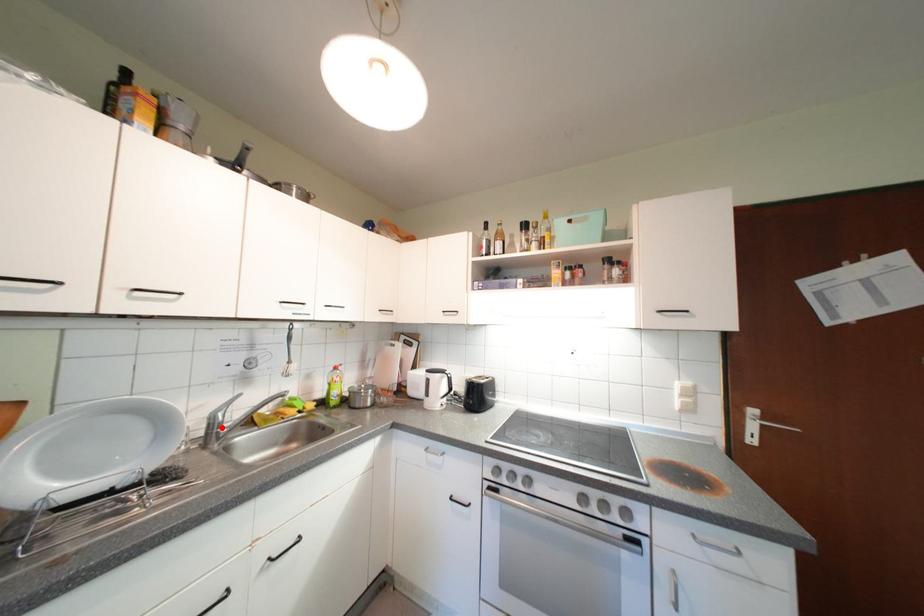
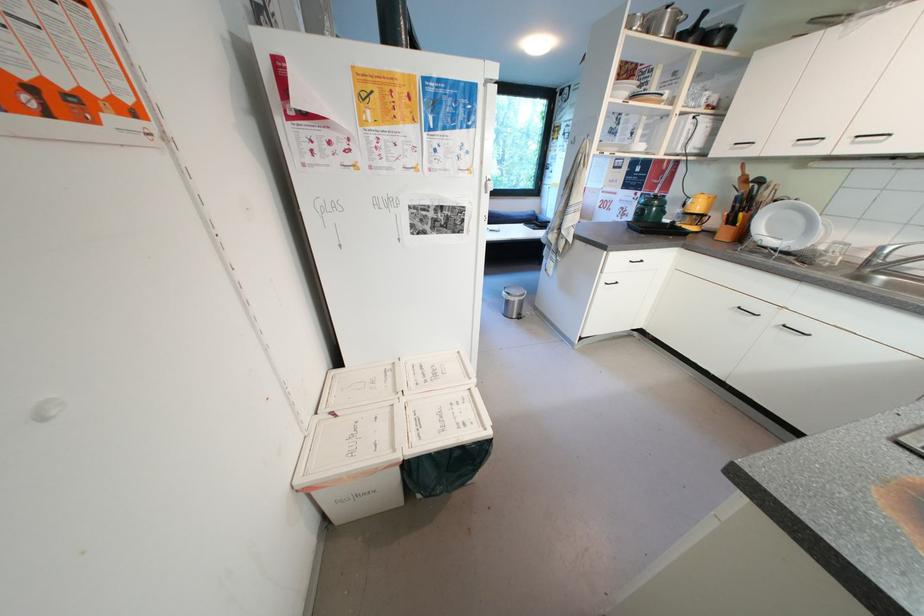
Question: I am providing you with two images of the same scene from different viewpoints. Image1 has a red point marked. In image2, the corresponding 3D location appears at what relative position? Reply with the corresponding letter.

Choices:
 (A) Closer
 (B) Farther

Answer: (B)